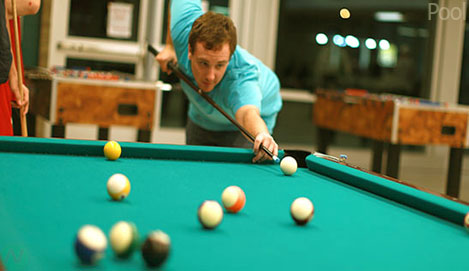
The image size is (469, 271). Find the location of `window`. window is located at coordinates (311, 48).